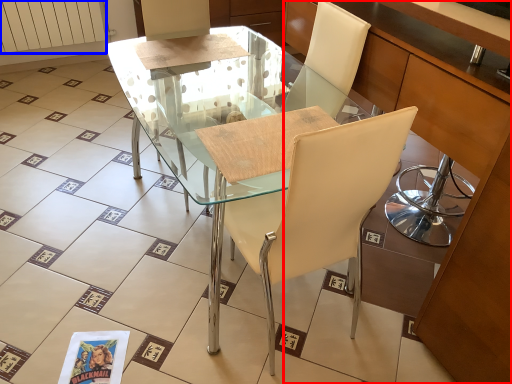
Question: Which point is further to the camera, cabinetry (highlighted by a red box) or radiator (highlighted by a blue box)?

Choices:
 (A) cabinetry
 (B) radiator

Answer: (B)